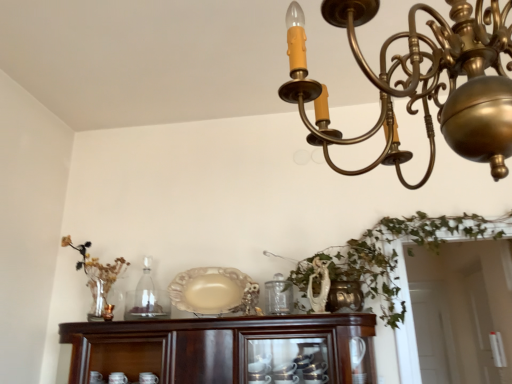
The width and height of the screenshot is (512, 384). What do you see at coordinates (426, 81) in the screenshot?
I see `gold metallic chandelier at upper center` at bounding box center [426, 81].

Measure the distance between point (135, 306) and camera.

They are 7.19 feet apart.

Where is `matte gold candle holder at left`? matte gold candle holder at left is located at coordinates (108, 312).

Between point (395, 67) and point (190, 358), which one is positioned in front?

Point (395, 67)

Between gold metallic chandelier at upper center and mahogany wood cabinet at lower center, which one appears on the right side from the viewer's perspective?

gold metallic chandelier at upper center.

In the scene shown: Does gold metallic chandelier at upper center have a smaller size compared to mahogany wood cabinet at lower center?

Actually, gold metallic chandelier at upper center might be larger than mahogany wood cabinet at lower center.

Is gold metallic chandelier at upper center beside mahogany wood cabinet at lower center?

No, gold metallic chandelier at upper center is not next to mahogany wood cabinet at lower center.

Which is more to the right, clear glass bottle at center or matte gold candle holder at left?

clear glass bottle at center.

Consider the image. From the image's perspective, who appears lower, clear glass bottle at center or matte gold candle holder at left?

From the image's view, matte gold candle holder at left is below.

Considering the relative positions of clear glass bottle at center and matte gold candle holder at left in the image provided, is clear glass bottle at center in front of matte gold candle holder at left?

No, it is behind matte gold candle holder at left.

Would you say clear glass bottle at center is a long distance from matte gold candle holder at left?

clear glass bottle at center is near matte gold candle holder at left, not far away.

Can you confirm if mahogany wood cabinet at lower center is wider than gold metallic chandelier at upper center?

No.

Could you tell me if mahogany wood cabinet at lower center is facing gold metallic chandelier at upper center?

No, mahogany wood cabinet at lower center does not turn towards gold metallic chandelier at upper center.

Does mahogany wood cabinet at lower center have a lesser height compared to gold metallic chandelier at upper center?

Yes, mahogany wood cabinet at lower center is shorter than gold metallic chandelier at upper center.

Consider the image. Which object is further away from the camera taking this photo, mahogany wood cabinet at lower center or gold metallic chandelier at upper center?

mahogany wood cabinet at lower center is further from the camera.

Could you tell me if gold metallic chandelier at upper center is turned towards clear glass bottle at center?

No, gold metallic chandelier at upper center is not facing towards clear glass bottle at center.

Which is closer to the camera, [506,108] or [141,292]?

Point [506,108] is positioned closer to the camera compared to point [141,292].

Are gold metallic chandelier at upper center and clear glass bottle at center beside each other?

gold metallic chandelier at upper center and clear glass bottle at center are clearly separated.

Can you confirm if gold metallic chandelier at upper center is positioned to the left of clear glass bottle at center?

Incorrect, gold metallic chandelier at upper center is not on the left side of clear glass bottle at center.

Between matte beige platter at center and matte gold candle holder at left, which one has less height?

With less height is matte gold candle holder at left.

Which is more to the right, matte beige platter at center or matte gold candle holder at left?

matte beige platter at center.

Would you consider matte gold candle holder at left to be distant from matte beige platter at center?

No, matte gold candle holder at left is not far away from matte beige platter at center.

Is matte gold candle holder at left taller than matte beige platter at center?

Incorrect, the height of matte gold candle holder at left is not larger of that of matte beige platter at center.

Considering the relative sizes of matte gold candle holder at left and matte beige platter at center in the image provided, is matte gold candle holder at left thinner than matte beige platter at center?

Correct, the width of matte gold candle holder at left is less than that of matte beige platter at center.

Relative to mahogany wood cabinet at lower center, is matte gold candle holder at left in front or behind?

matte gold candle holder at left is positioned farther from the viewer than mahogany wood cabinet at lower center.

From the image's perspective, which is below, matte gold candle holder at left or mahogany wood cabinet at lower center?

mahogany wood cabinet at lower center.

Between matte gold candle holder at left and mahogany wood cabinet at lower center, which one appears on the left side from the viewer's perspective?

From the viewer's perspective, matte gold candle holder at left appears more on the left side.

Is matte gold candle holder at left touching mahogany wood cabinet at lower center?

They are not placed beside each other.

Where is `cabinetry below the gold metallic chandelier at upper center (from the image's perspective)`? cabinetry below the gold metallic chandelier at upper center (from the image's perspective) is located at coordinates (220, 347).

You are a GUI agent. You are given a task and a screenshot of the screen. Output one action in this format:
    pyautogui.click(x=<x>, y=<y>)
    Task: Click on the candle holder located underneath the clear glass bottle at center (from a real-world perspective)
    This screenshot has height=384, width=512.
    Given the screenshot: What is the action you would take?
    pyautogui.click(x=108, y=312)

When comparing their distances from gold metallic chandelier at upper center, does matte gold candle holder at left or mahogany wood cabinet at lower center seem closer?

The object closer to gold metallic chandelier at upper center is mahogany wood cabinet at lower center.

Considering their positions, is gold metallic chandelier at upper center positioned closer to mahogany wood cabinet at lower center than clear glass bottle at center?

clear glass bottle at center is positioned closer to the anchor mahogany wood cabinet at lower center.

Looking at the image, which one is located further to mahogany wood cabinet at lower center, matte beige platter at center or matte gold candle holder at left?

matte gold candle holder at left lies further to mahogany wood cabinet at lower center than the other object.

From the image, which object appears to be farther from matte gold candle holder at left, mahogany wood cabinet at lower center or clear glass bottle at center?

mahogany wood cabinet at lower center.

When comparing their distances from clear glass bottle at center, does gold metallic chandelier at upper center or matte beige platter at center seem closer?

The object closer to clear glass bottle at center is matte beige platter at center.

Based on their spatial positions, is gold metallic chandelier at upper center or matte gold candle holder at left closer to clear glass bottle at center?

matte gold candle holder at left is positioned closer to the anchor clear glass bottle at center.

Considering their positions, is matte gold candle holder at left positioned further to matte beige platter at center than gold metallic chandelier at upper center?

The object further to matte beige platter at center is gold metallic chandelier at upper center.

Which object lies nearer to the anchor point matte beige platter at center, clear glass bottle at center or matte gold candle holder at left?

clear glass bottle at center.

The height and width of the screenshot is (384, 512). Identify the location of cabinetry between gold metallic chandelier at upper center and clear glass bottle at center from front to back. (220, 347).

Identify the location of platter located between matte gold candle holder at left and mahogany wood cabinet at lower center in the left-right direction. 215,291.

You are a GUI agent. You are given a task and a screenshot of the screen. Output one action in this format:
    pyautogui.click(x=<x>, y=<y>)
    Task: Click on the cabinetry between gold metallic chandelier at upper center and matte beige platter at center along the z-axis
    
    Given the screenshot: What is the action you would take?
    pyautogui.click(x=220, y=347)

Locate an element on the screen. platter between gold metallic chandelier at upper center and clear glass bottle at center along the z-axis is located at coordinates (215, 291).